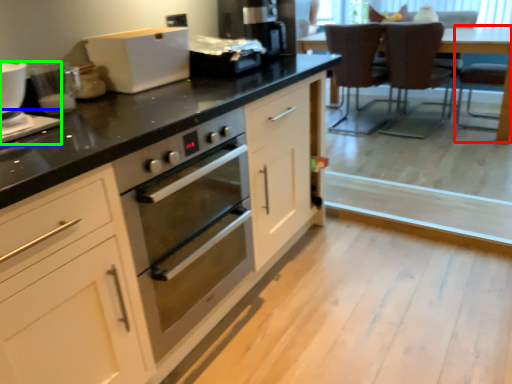
Question: Which is nearer to the armchair (highlighted by a red box)? appliance (highlighted by a blue box) or appliance (highlighted by a green box).

Choices:
 (A) appliance
 (B) appliance

Answer: (B)